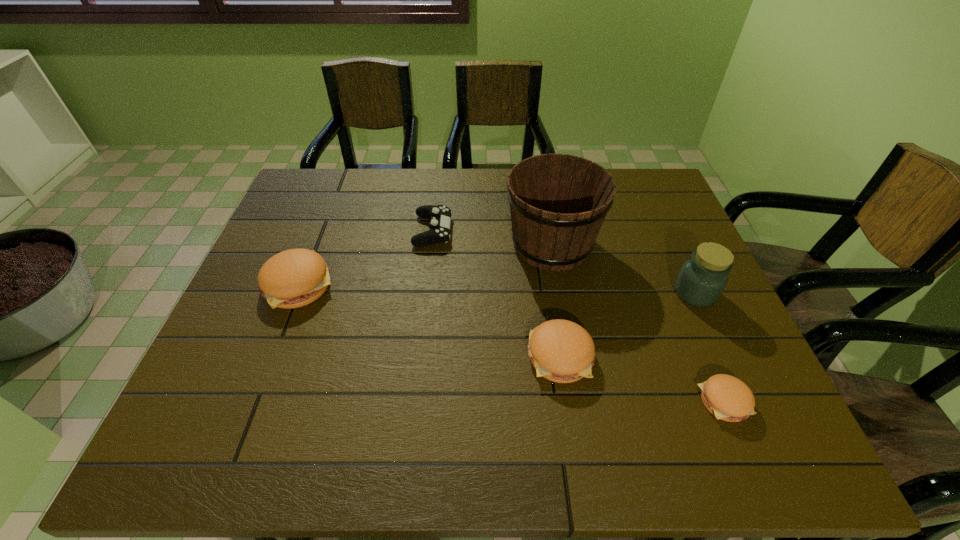
Find the location of a particular element. Image resolution: width=960 pixels, height=540 pixels. vacant area situated 0.240m on the right of the second patty from left to right is located at coordinates (701, 356).

Image resolution: width=960 pixels, height=540 pixels. In order to click on free location located 0.260m on the back of the shortest patty in this screenshot , I will do `click(678, 291)`.

Identify the location of vacant space located 0.200m on the left of the tallest object. (433, 244).

The image size is (960, 540). Identify the location of free space located 0.260m on the surface of the second shortest object. pyautogui.click(x=540, y=231).

At what (x,y) coordinates should I click in order to perform the action: click on free region located 0.250m on the front of the second tallest object. Please return your answer as a coordinate pair (x, y). Looking at the image, I should click on (745, 403).

Where is `object located in the left edge section of the desktop`? This screenshot has height=540, width=960. object located in the left edge section of the desktop is located at coordinates (294, 278).

This screenshot has width=960, height=540. I want to click on patty at the right edge, so click(x=728, y=398).

This screenshot has width=960, height=540. What are the coordinates of `jar positioned at the right edge` in the screenshot? It's located at (702, 279).

Find the location of a particular element. object present at the near right corner is located at coordinates tap(728, 398).

Where is `vacant area at the far edge`? vacant area at the far edge is located at coordinates (383, 202).